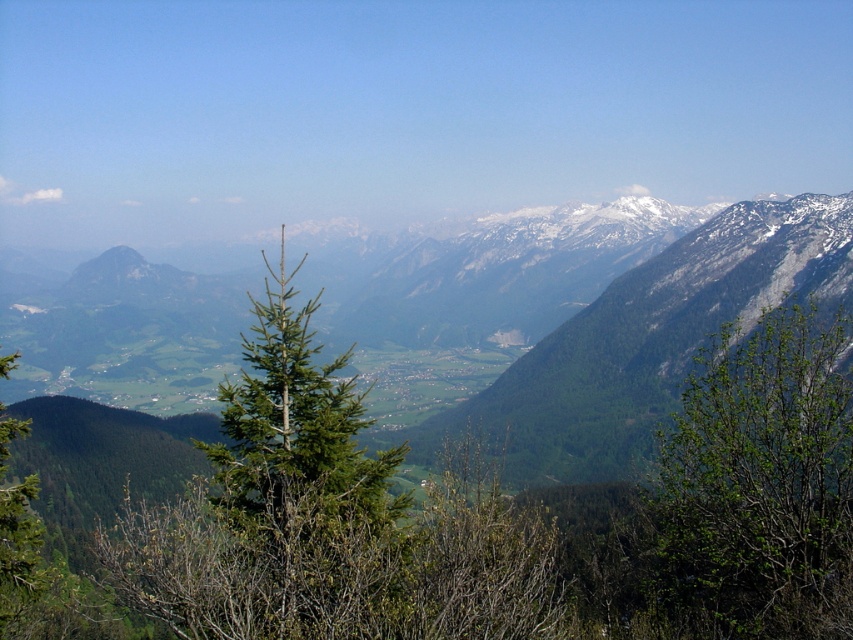
Is green leafy tree at center-right further to camera compared to green forested mountain range at center?

That is False.

Between point (840, 397) and point (514, 429), which one is positioned behind?

Point (514, 429)

You are a GUI agent. You are given a task and a screenshot of the screen. Output one action in this format:
    pyautogui.click(x=<x>, y=<y>)
    Task: Click on the green leafy tree at center-right
    The image size is (853, 640).
    Given the screenshot: What is the action you would take?
    pyautogui.click(x=755, y=486)

How distant is green forested mountain range at center from green needle-like tree at center?

They are 191.92 meters apart.

Can you confirm if green forested mountain range at center is positioned to the left of green needle-like tree at center?

In fact, green forested mountain range at center is to the right of green needle-like tree at center.

What do you see at coordinates (650, 339) in the screenshot? Image resolution: width=853 pixels, height=640 pixels. I see `green forested mountain range at center` at bounding box center [650, 339].

The width and height of the screenshot is (853, 640). What are the coordinates of `green forested mountain range at center` in the screenshot? It's located at (650, 339).

Which is more to the left, green leafy tree at center-right or green needle-like tree at center?

From the viewer's perspective, green needle-like tree at center appears more on the left side.

Describe the element at coordinates (755, 486) in the screenshot. I see `green leafy tree at center-right` at that location.

You are a GUI agent. You are given a task and a screenshot of the screen. Output one action in this format:
    pyautogui.click(x=<x>, y=<y>)
    Task: Click on the green leafy tree at center-right
    The height and width of the screenshot is (640, 853).
    Given the screenshot: What is the action you would take?
    pyautogui.click(x=755, y=486)